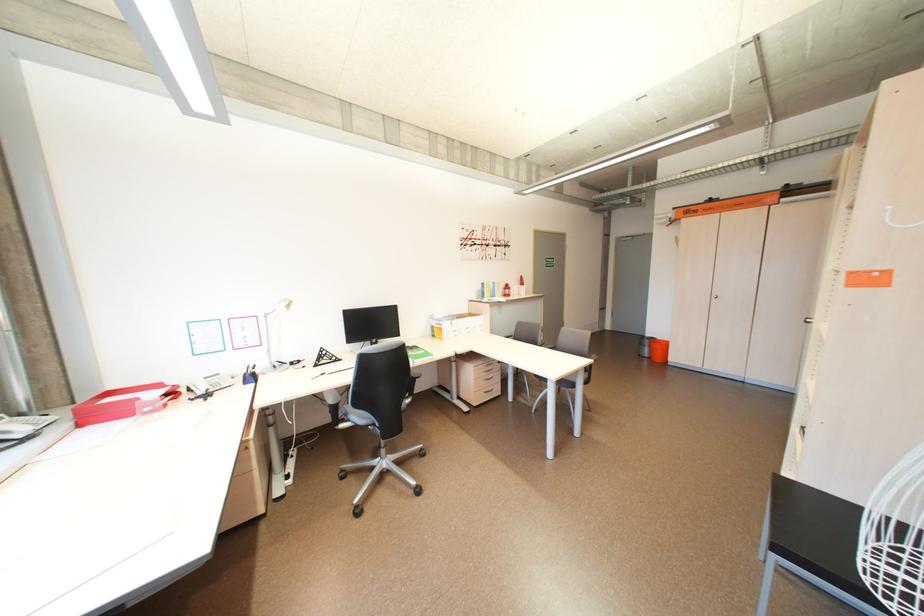
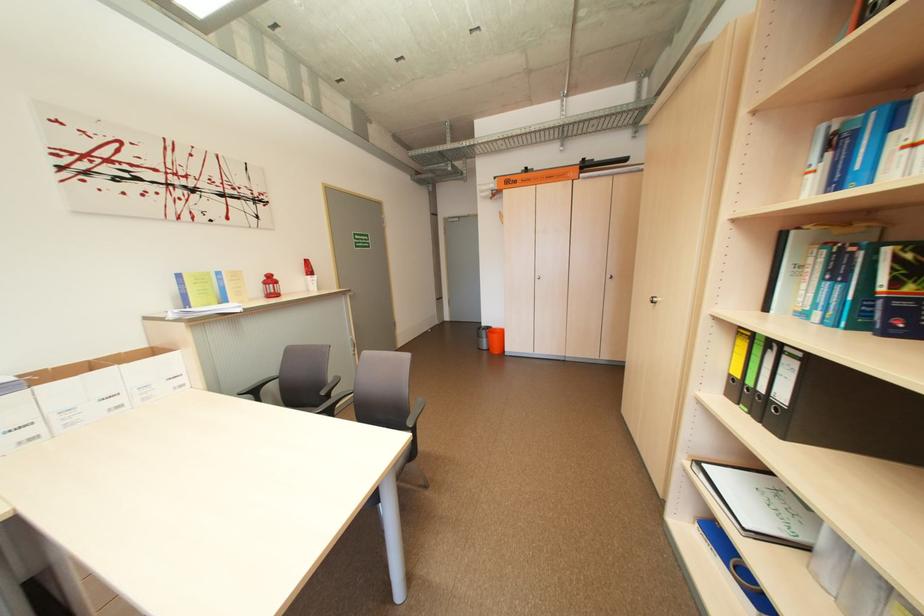
Where in the second image is the point corresponding to (467,318) from the first image?

(43, 384)